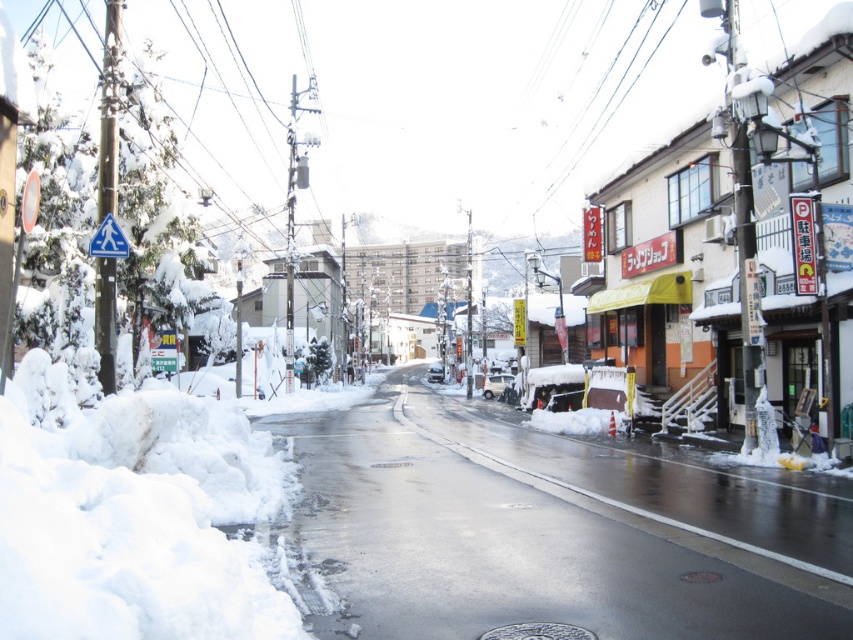
Question: Which object is closer to the camera taking this photo?

Choices:
 (A) silver metallic manhole cover at center
 (B) brown textured manhole cover at center

Answer: (A)

Question: Considering the real-world distances, which object is closest to the silver metallic manhole cover at center?

Choices:
 (A) brown textured manhole cover at center
 (B) gray metallic manhole cover at center
 (C) white fluffy snow at lower left
 (D) blue plastic pedestrian sign at upper left

Answer: (A)

Question: Which of the following is the farthest from the observer?

Choices:
 (A) silver metallic manhole cover at center
 (B) gray metallic manhole cover at center
 (C) brown textured manhole cover at center
 (D) blue plastic pedestrian sign at upper left

Answer: (B)

Question: Considering the relative positions of white fluffy snow at lower left and blue plastic pedestrian sign at upper left in the image provided, where is white fluffy snow at lower left located with respect to blue plastic pedestrian sign at upper left?

Choices:
 (A) above
 (B) below

Answer: (B)

Question: Does white fluffy snow at lower left appear on the right side of brown textured manhole cover at center?

Choices:
 (A) no
 (B) yes

Answer: (A)

Question: Can you confirm if blue plastic pedestrian sign at upper left is positioned to the right of brown textured manhole cover at center?

Choices:
 (A) no
 (B) yes

Answer: (A)